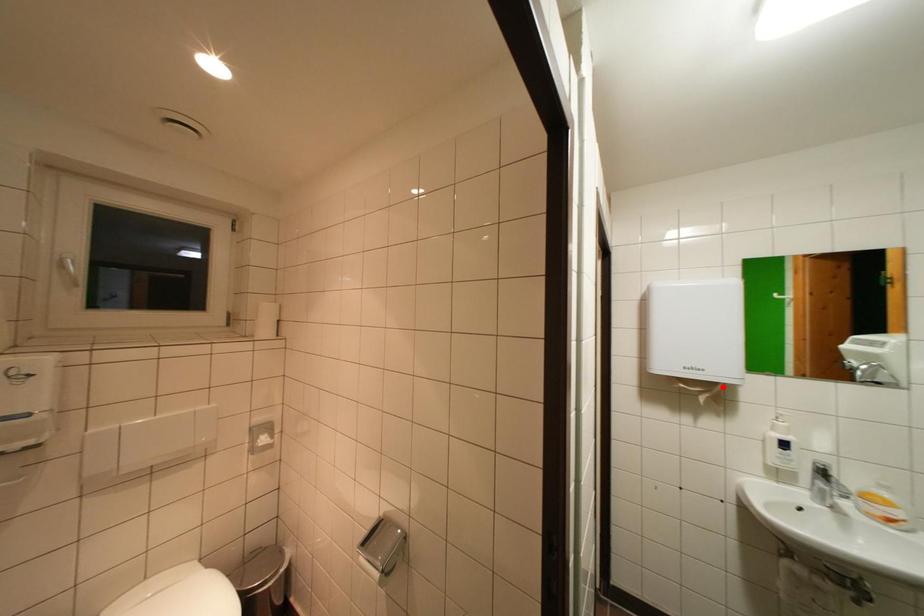
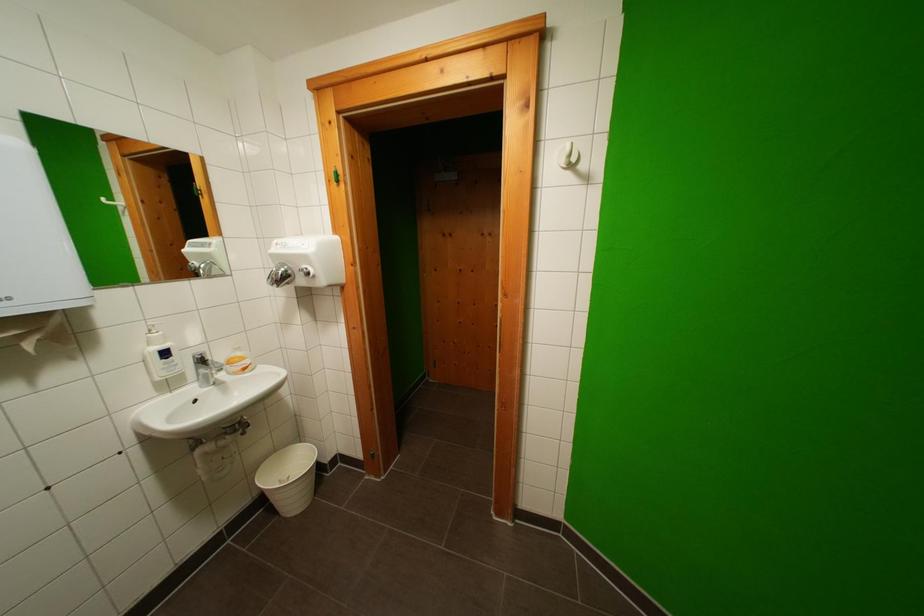
Where in the second image is the point corresponding to the highlighted location from the first image?

(55, 317)